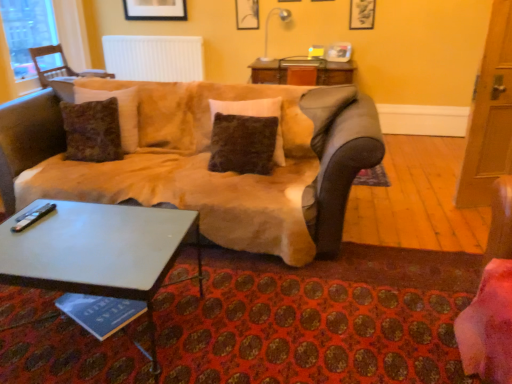
I want to click on vacant space situated above white ribbed radiator at upper center (from a real-world perspective), so coord(162,28).